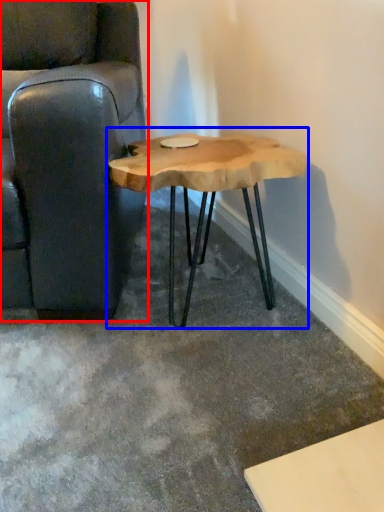
Question: Which of the following is the farthest to the observer, chair (highlighted by a red box) or coffee table (highlighted by a blue box)?

Choices:
 (A) chair
 (B) coffee table

Answer: (B)